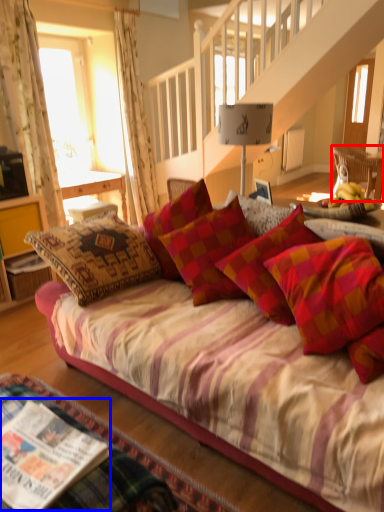
Question: Which object appears farthest to the camera in this image, chair (highlighted by a red box) or magazine (highlighted by a blue box)?

Choices:
 (A) chair
 (B) magazine

Answer: (A)